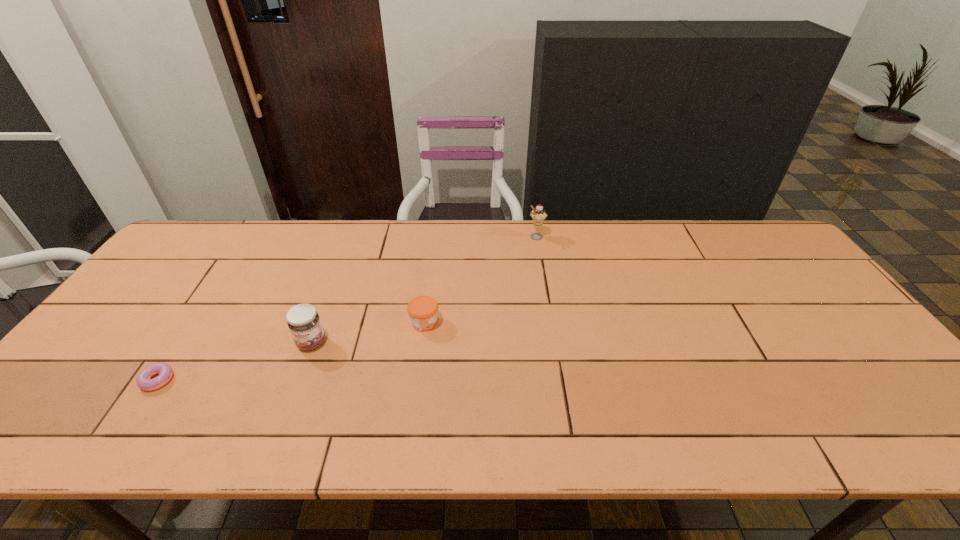
Identify the location of vacant space that satisfies the following two spatial constraints: 1. on the back side of the tallest object; 2. on the right side of the leftmost object. (252, 237).

Where is `vacant space that satisfies the following two spatial constraints: 1. on the front label of the right jam; 2. on the front label of the left jam`? The height and width of the screenshot is (540, 960). vacant space that satisfies the following two spatial constraints: 1. on the front label of the right jam; 2. on the front label of the left jam is located at coordinates (422, 342).